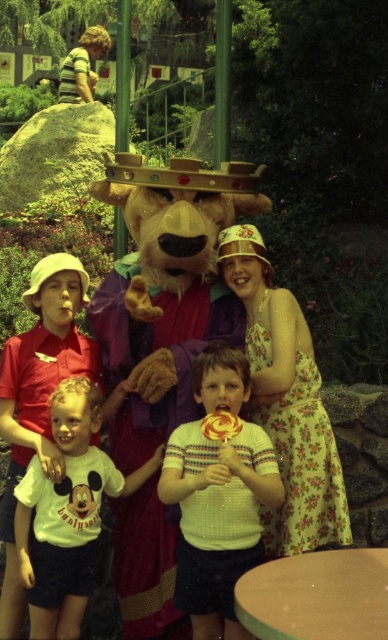
Question: Is floral dress at center wider than white cotton shirt at center?

Choices:
 (A) yes
 (B) no

Answer: (B)

Question: Which point is farther to the camera?

Choices:
 (A) (256, 252)
 (B) (69, 465)
 (C) (176, 593)
 (D) (119, 540)

Answer: (D)

Question: Which point is closer to the camera?

Choices:
 (A) floral dress at center
 (B) yellow knitted sweater at center
 (C) white cotton shirt at center

Answer: (B)

Question: Is yellow knitted sweater at center to the left of floral dress at center from the viewer's perspective?

Choices:
 (A) yes
 (B) no

Answer: (A)

Question: In this image, where is floral dress at center located relative to white cotton shirt at center?

Choices:
 (A) left
 (B) right

Answer: (B)

Question: Which object appears closest to the camera in this image?

Choices:
 (A) fuzzy brown bear at center
 (B) white cotton shirt at center
 (C) yellow knitted sweater at center
 (D) floral dress at center

Answer: (C)